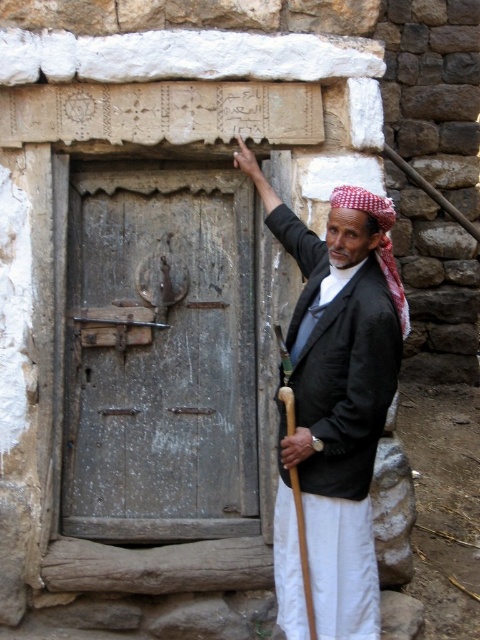
You are a photographer trying to capture the entire weathered wood door at center and the black woolen jacket at center in a single frame. Given that your camera has a fixed focal length, which object should you position closer to the camera to ensure both fit in the frame?

Since the weathered wood door at center is wider than the black woolen jacket at center, you should position the black woolen jacket at center closer to the camera. This way, the jacket will appear larger in the frame, balancing the sizes of both objects to fit within the camera view.